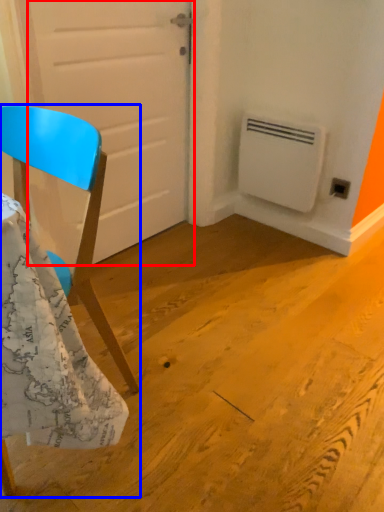
Question: Among these objects, which one is farthest to the camera, door (highlighted by a red box) or chair (highlighted by a blue box)?

Choices:
 (A) door
 (B) chair

Answer: (A)